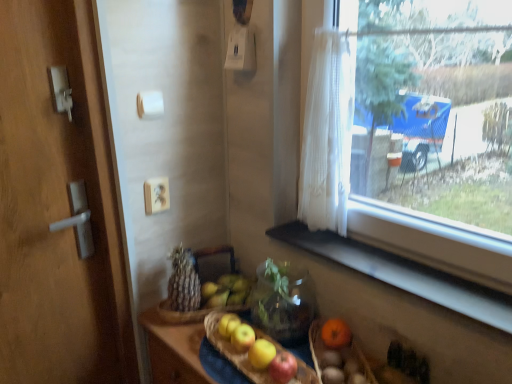
Question: Is point (302, 233) positioned closer to the camera than point (320, 364)?

Choices:
 (A) closer
 (B) farther

Answer: (B)

Question: In terms of size, does black matte window sill at lower right appear bigger or smaller than matte brown wicker basket at lower right, the 1th basket positioned from the right?

Choices:
 (A) big
 (B) small

Answer: (A)

Question: Which of these objects is positioned closest to the brown textured bread at center?

Choices:
 (A) transparent glass window at upper right
 (B) black matte window sill at lower right
 (C) matte brown wicker basket at lower right, the 1th basket positioned from the right
 (D) white plastic light switch at upper center
 (E) wooden door handle at left

Answer: (E)

Question: Estimate the real-world distances between objects in this image. Which object is farther from the white plastic knob at upper center?

Choices:
 (A) matte brown wicker basket at lower right, the second basket when ordered from left to right
 (B) brown textured bread at center
 (C) white matte electric outlet at upper center
 (D) transparent glass window at upper right
 (E) wooden door handle at left

Answer: (A)